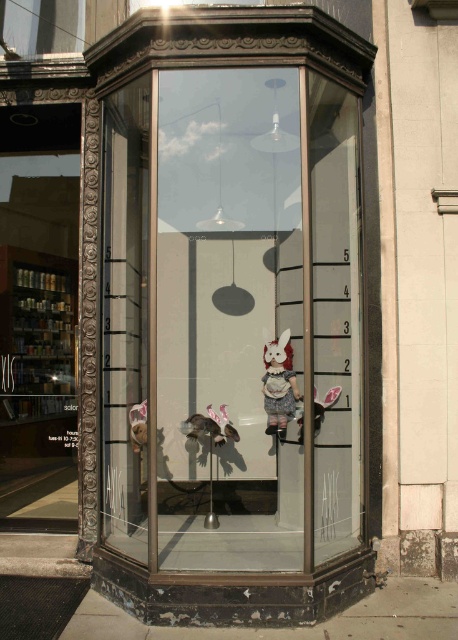
You are a customer looking at the bay window display of the shop. You notice the clear glass shelves at left and the matte fabric doll at center. Which object is taller?

The clear glass shelves at left is taller than the matte fabric doll at center.

You are standing in front of the shop window and see two points marked in the display. The first point is at coordinates point (270, 417) and the second is at point (299, 408). Which point is closer to you?

Point (270, 417) is further to the camera than point (299, 408). Therefore, point (299, 408) is closer to you.

You are a customer standing outside the shop looking through the bay window display. You notice the transparent glass door at center and the white plush rabbit at center. Which object is higher up in the display?

The transparent glass door at center is above the white plush rabbit at center, so it is higher up in the display.